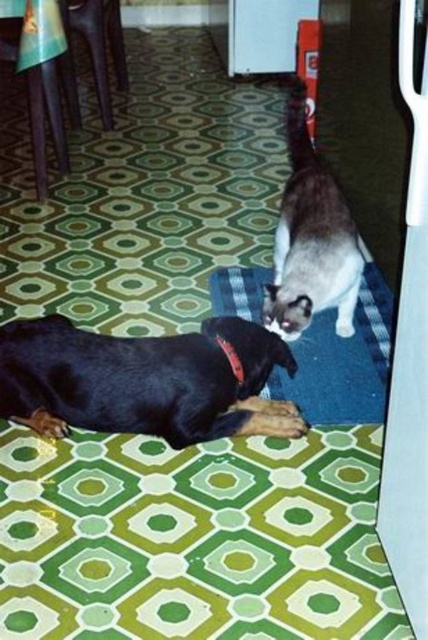
You are standing in the room and want to place a small toy between the white fur cat at upper center and the dog lying on its side. Based on their positions, where should you place the toy to ensure it is equidistant from both animals?

The white fur cat at upper center is located at point [311,237]. To place the toy equidistant from both animals, you should position it along the perpendicular bisector of the line segment connecting the cat and the dog.

You are standing in the room and want to pick up the white fur cat at upper center and the blue carpet at center. Which object is closer to you?

The white fur cat at upper center is closer to you because it is further to the viewer than the blue carpet at center.

You are a photographer trying to capture a closeup of the black fabric neckband at lower center. You want to ensure the black glossy dog at lower left doesn

The black glossy dog at lower left is bigger than the black fabric neckband at lower center, so it might block the view of the neckband if positioned too close.